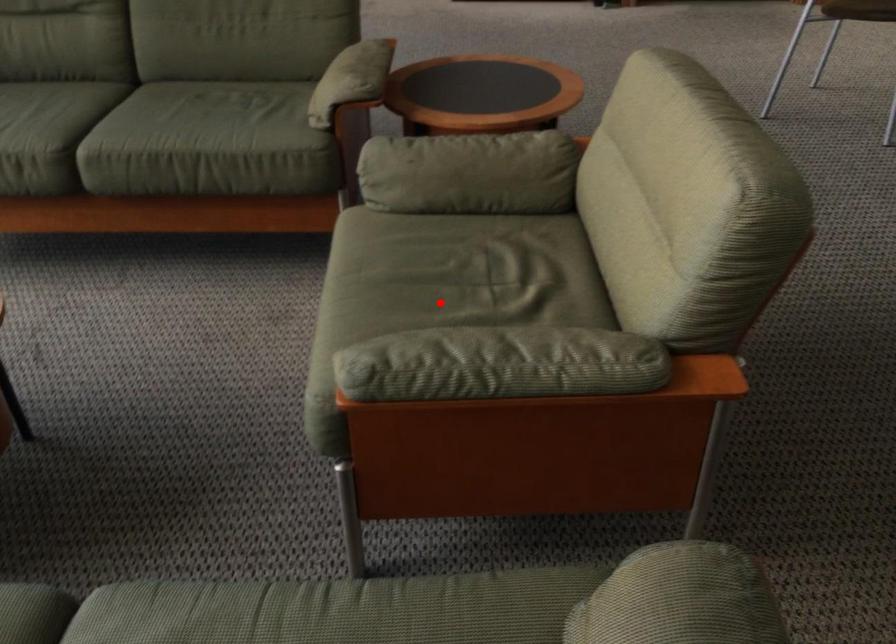
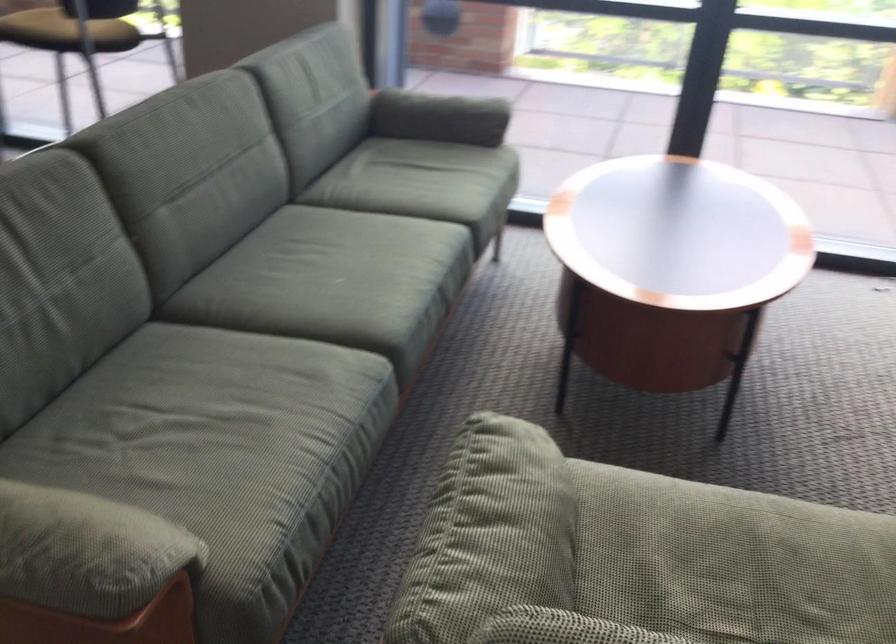
The point at the highlighted location is marked in the first image. Where is the corresponding point in the second image?

(702, 582)